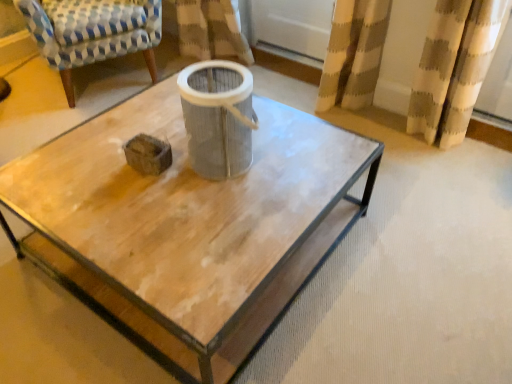
What do you see at coordinates (218, 117) in the screenshot? This screenshot has width=512, height=384. I see `gray fabric filter at center` at bounding box center [218, 117].

The width and height of the screenshot is (512, 384). I want to click on blue and white checkered fabric armchair at upper left, so click(x=92, y=32).

Could you tell me if wooden coffee table at center is turned towards blue and white checkered fabric armchair at upper left?

No.

Is wooden coffee table at center not within blue and white checkered fabric armchair at upper left?

wooden coffee table at center lies outside blue and white checkered fabric armchair at upper left's area.

From a real-world perspective, is wooden coffee table at center located higher than blue and white checkered fabric armchair at upper left?

No, from a real-world perspective, wooden coffee table at center is not over blue and white checkered fabric armchair at upper left

Consider the image. Considering the relative positions of wooden coffee table at center and blue and white checkered fabric armchair at upper left in the image provided, is wooden coffee table at center to the right of blue and white checkered fabric armchair at upper left from the viewer's perspective?

Indeed, wooden coffee table at center is positioned on the right side of blue and white checkered fabric armchair at upper left.

Is blue and white checkered fabric armchair at upper left with gray fabric filter at center?

No, blue and white checkered fabric armchair at upper left is not beside gray fabric filter at center.

At what (x,y) coordinates should I click in order to perform the action: click on gray above the blue and white checkered fabric armchair at upper left (from a real-world perspective). Please return your answer as a coordinate pair (x, y). This screenshot has height=384, width=512. Looking at the image, I should click on click(x=218, y=117).

Is blue and white checkered fabric armchair at upper left aimed at gray fabric filter at center?

Yes.

Considering the relative positions of blue and white checkered fabric armchair at upper left and gray fabric filter at center in the image provided, is blue and white checkered fabric armchair at upper left to the left of gray fabric filter at center from the viewer's perspective?

Correct, you'll find blue and white checkered fabric armchair at upper left to the left of gray fabric filter at center.

Does gray fabric filter at center have a greater height compared to wooden coffee table at center?

Yes, gray fabric filter at center is taller than wooden coffee table at center.

Is gray fabric filter at center in contact with wooden coffee table at center?

There is a gap between gray fabric filter at center and wooden coffee table at center.

Is gray fabric filter at center to the left or to the right of wooden coffee table at center in the image?

In the image, gray fabric filter at center appears on the right side of wooden coffee table at center.

Is gray fabric filter at center further to the viewer compared to wooden coffee table at center?

That is True.

From the image's perspective, relative to wooden coffee table at center, is blue and white checkered fabric armchair at upper left above or below?

From the image's perspective, blue and white checkered fabric armchair at upper left appears above wooden coffee table at center.

Considering the points (125, 13) and (88, 205), which point is in front, point (125, 13) or point (88, 205)?

The point (88, 205) is closer to the camera.

Is the position of blue and white checkered fabric armchair at upper left more distant than that of wooden coffee table at center?

Yes, it is behind wooden coffee table at center.

Can you confirm if blue and white checkered fabric armchair at upper left is smaller than wooden coffee table at center?

Indeed, blue and white checkered fabric armchair at upper left has a smaller size compared to wooden coffee table at center.

Is gray fabric filter at center to the left or to the right of blue and white checkered fabric armchair at upper left in the image?

In the image, gray fabric filter at center appears on the right side of blue and white checkered fabric armchair at upper left.

Which object is wider, gray fabric filter at center or blue and white checkered fabric armchair at upper left?

blue and white checkered fabric armchair at upper left is wider.

Which object is further away from the camera taking this photo, gray fabric filter at center or blue and white checkered fabric armchair at upper left?

blue and white checkered fabric armchair at upper left is further away from the camera.

Would you say gray fabric filter at center is inside or outside blue and white checkered fabric armchair at upper left?

The correct answer is: outside.

Which object is positioned more to the left, wooden coffee table at center or gray fabric filter at center?

Positioned to the left is wooden coffee table at center.

Is wooden coffee table at center bigger or smaller than gray fabric filter at center?

Considering their sizes, wooden coffee table at center takes up more space than gray fabric filter at center.

Considering the relative sizes of wooden coffee table at center and gray fabric filter at center in the image provided, is wooden coffee table at center thinner than gray fabric filter at center?

No, wooden coffee table at center is not thinner than gray fabric filter at center.

I want to click on chair behind the wooden coffee table at center, so click(x=92, y=32).

This screenshot has width=512, height=384. Find the location of `gray in front of the blue and white checkered fabric armchair at upper left`. gray in front of the blue and white checkered fabric armchair at upper left is located at coordinates (218, 117).

Based on their spatial positions, is wooden coffee table at center or blue and white checkered fabric armchair at upper left further from gray fabric filter at center?

Based on the image, blue and white checkered fabric armchair at upper left appears to be further to gray fabric filter at center.

Considering their positions, is gray fabric filter at center positioned further to blue and white checkered fabric armchair at upper left than wooden coffee table at center?

Based on the image, gray fabric filter at center appears to be further to blue and white checkered fabric armchair at upper left.

Which object lies further to the anchor point gray fabric filter at center, blue and white checkered fabric armchair at upper left or wooden coffee table at center?

blue and white checkered fabric armchair at upper left is further to gray fabric filter at center.

Based on their spatial positions, is wooden coffee table at center or gray fabric filter at center further from blue and white checkered fabric armchair at upper left?

gray fabric filter at center is positioned further to the anchor blue and white checkered fabric armchair at upper left.

Based on the photo, looking at the image, which one is located further to wooden coffee table at center, blue and white checkered fabric armchair at upper left or gray fabric filter at center?

blue and white checkered fabric armchair at upper left lies further to wooden coffee table at center than the other object.

When comparing their distances from wooden coffee table at center, does gray fabric filter at center or blue and white checkered fabric armchair at upper left seem further?

Among the two, blue and white checkered fabric armchair at upper left is located further to wooden coffee table at center.

Find the location of `gray between wooden coffee table at center and blue and white checkered fabric armchair at upper left from front to back`. gray between wooden coffee table at center and blue and white checkered fabric armchair at upper left from front to back is located at coordinates (218, 117).